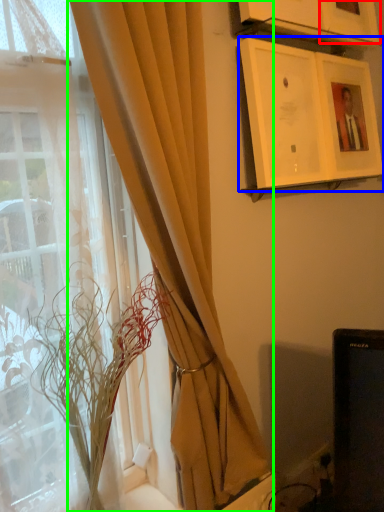
Question: Considering the real-world distances, which object is closest to picture frame (highlighted by a red box)? picture frame (highlighted by a blue box) or curtain (highlighted by a green box).

Choices:
 (A) picture frame
 (B) curtain

Answer: (A)